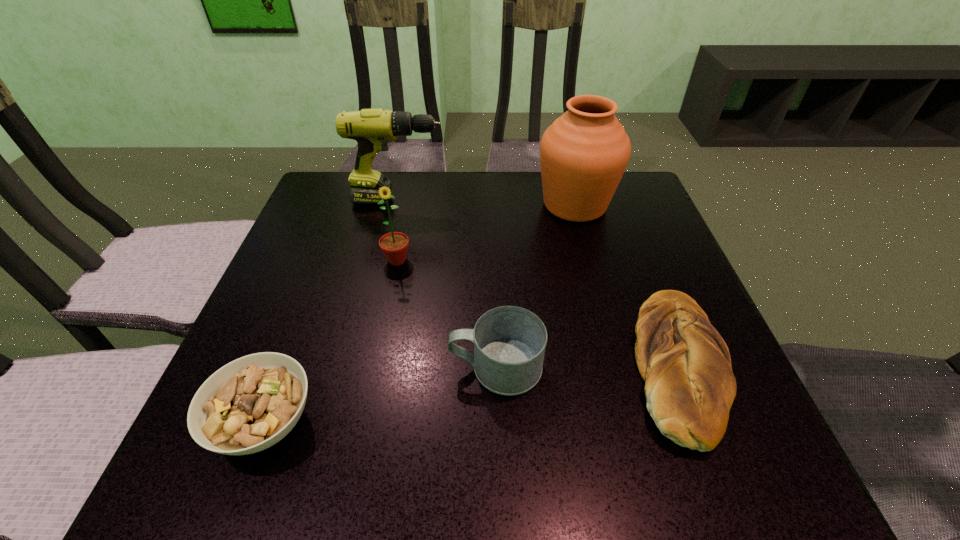
Find the location of a particular element. The image size is (960, 540). urn is located at coordinates (583, 154).

The image size is (960, 540). I want to click on drill, so click(372, 128).

Locate an element on the screen. The image size is (960, 540). the third tallest object is located at coordinates (394, 245).

At what (x,y) coordinates should I click in order to perform the action: click on sunflower. Please return your answer as a coordinate pair (x, y). This screenshot has height=540, width=960. Looking at the image, I should click on (394, 245).

Where is `the third shortest object`? the third shortest object is located at coordinates (509, 342).

I want to click on mug, so click(509, 342).

Where is `stew`? stew is located at coordinates (248, 405).

This screenshot has width=960, height=540. What are the coordinates of `bread` in the screenshot? It's located at click(x=689, y=385).

Locate an element on the screen. vacant area located on the left of the urn is located at coordinates (515, 205).

Find the location of `vacant area situated on the handle side of the drill`. vacant area situated on the handle side of the drill is located at coordinates (538, 200).